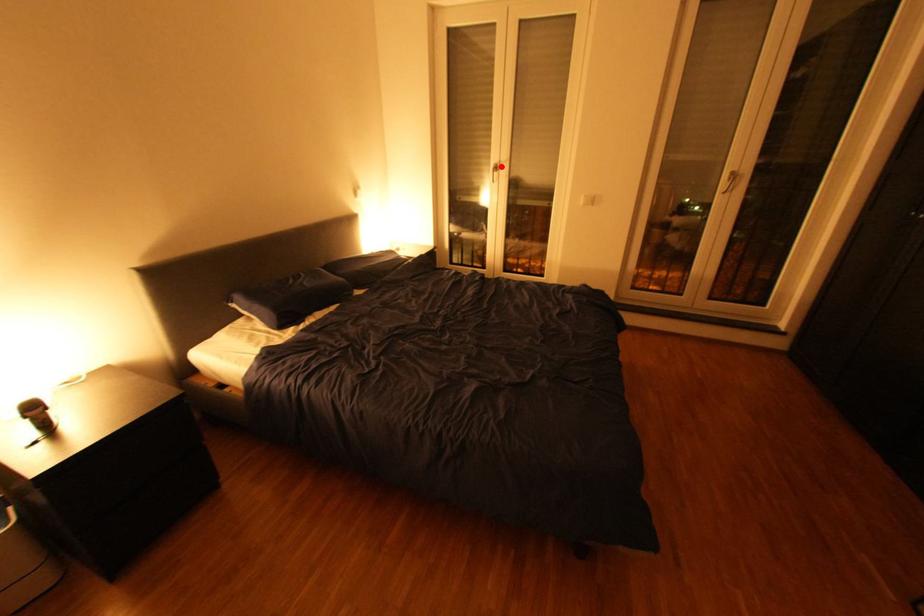
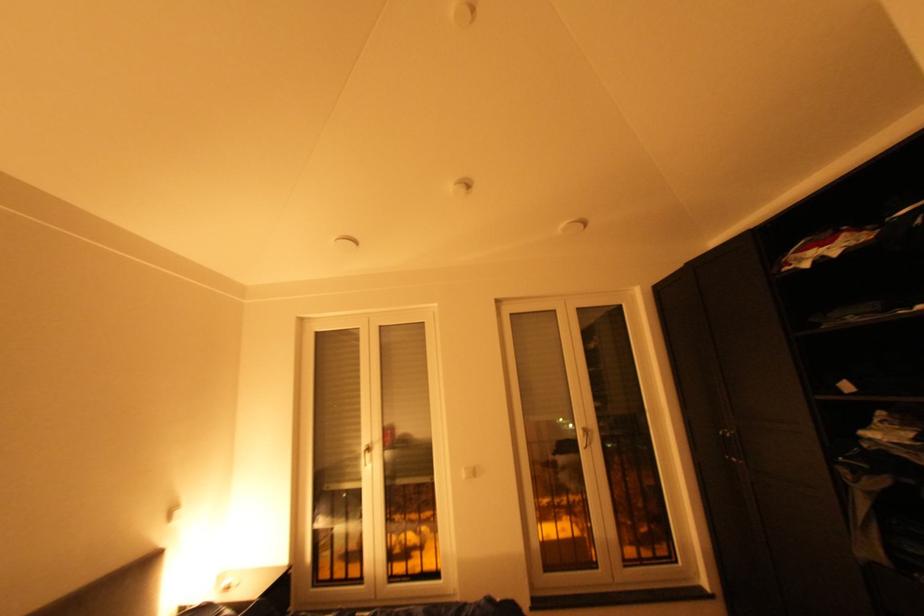
Question: I am providing you with two images of the same scene from different viewpoints. Given a red point in image1, look at the same physical point in image2. Is it:

Choices:
 (A) Closer to the viewpoint
 (B) Farther from the viewpoint

Answer: (B)